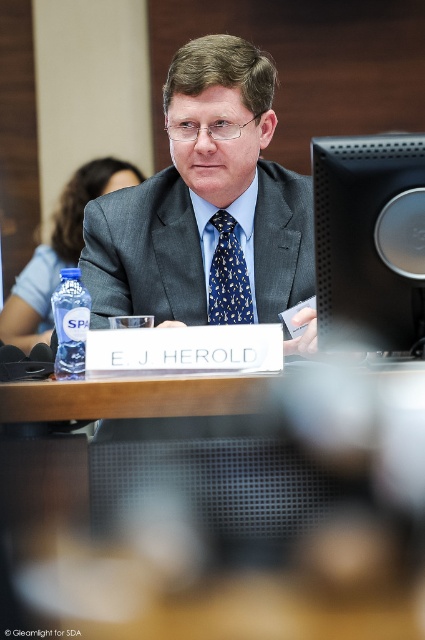
Between matte gray suit at center and blue printed silk tie at center, which one appears on the left side from the viewer's perspective?

From the viewer's perspective, matte gray suit at center appears more on the left side.

This screenshot has height=640, width=425. Find the location of `matte gray suit at center`. matte gray suit at center is located at coordinates (206, 205).

Identify the location of matte gray suit at center. (206, 205).

Find the location of a particular element. This screenshot has width=425, height=640. matte gray suit at center is located at coordinates (206, 205).

Can you confirm if black matte monitor at upper right is positioned below blue printed silk tie at center?

Indeed, black matte monitor at upper right is positioned under blue printed silk tie at center.

Image resolution: width=425 pixels, height=640 pixels. Describe the element at coordinates (370, 243) in the screenshot. I see `black matte monitor at upper right` at that location.

At what (x,y) coordinates should I click in order to perform the action: click on black matte monitor at upper right. Please return your answer as a coordinate pair (x, y). Looking at the image, I should click on (370, 243).

Between point (99, 300) and point (359, 192), which one is positioned behind?

The point (99, 300) is behind.

Can you confirm if matte gray suit at center is smaller than black matte monitor at upper right?

Incorrect, matte gray suit at center is not smaller in size than black matte monitor at upper right.

What are the coordinates of `matte gray suit at center` in the screenshot? It's located at (206, 205).